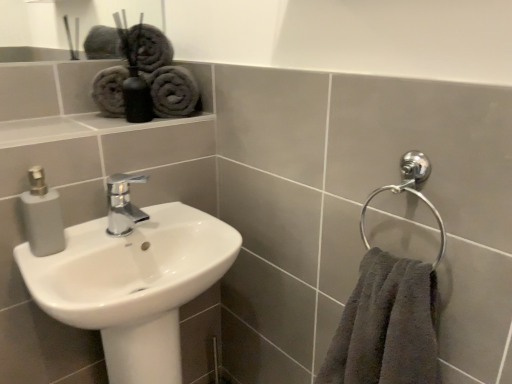
Question: Considering the relative sizes of gray cotton towels at upper left and polished chrome faucet at center in the image provided, is gray cotton towels at upper left shorter than polished chrome faucet at center?

Choices:
 (A) no
 (B) yes

Answer: (A)

Question: Is gray cotton towels at upper left closer to the viewer compared to polished chrome faucet at center?

Choices:
 (A) no
 (B) yes

Answer: (A)

Question: From a real-world perspective, is gray cotton towels at upper left beneath polished chrome faucet at center?

Choices:
 (A) no
 (B) yes

Answer: (A)

Question: Does gray cotton towels at upper left have a greater height compared to polished chrome faucet at center?

Choices:
 (A) no
 (B) yes

Answer: (B)

Question: Can you confirm if gray cotton towels at upper left is bigger than polished chrome faucet at center?

Choices:
 (A) yes
 (B) no

Answer: (A)

Question: Is gray cotton towels at upper left further to the viewer compared to polished chrome faucet at center?

Choices:
 (A) yes
 (B) no

Answer: (A)

Question: Does dark gray plush towel at right appear on the left side of white glossy sink at lower left?

Choices:
 (A) no
 (B) yes

Answer: (A)

Question: Does dark gray plush towel at right have a greater height compared to white glossy sink at lower left?

Choices:
 (A) yes
 (B) no

Answer: (B)

Question: From the image's perspective, is dark gray plush towel at right over white glossy sink at lower left?

Choices:
 (A) yes
 (B) no

Answer: (A)

Question: Considering the relative sizes of dark gray plush towel at right and white glossy sink at lower left in the image provided, is dark gray plush towel at right shorter than white glossy sink at lower left?

Choices:
 (A) no
 (B) yes

Answer: (B)

Question: Is dark gray plush towel at right positioned in front of white glossy sink at lower left?

Choices:
 (A) yes
 (B) no

Answer: (A)

Question: From a real-world perspective, is dark gray plush towel at right located beneath white glossy sink at lower left?

Choices:
 (A) yes
 (B) no

Answer: (B)

Question: Can you confirm if gray cotton towels at upper left is shorter than white glossy sink at lower left?

Choices:
 (A) no
 (B) yes

Answer: (B)